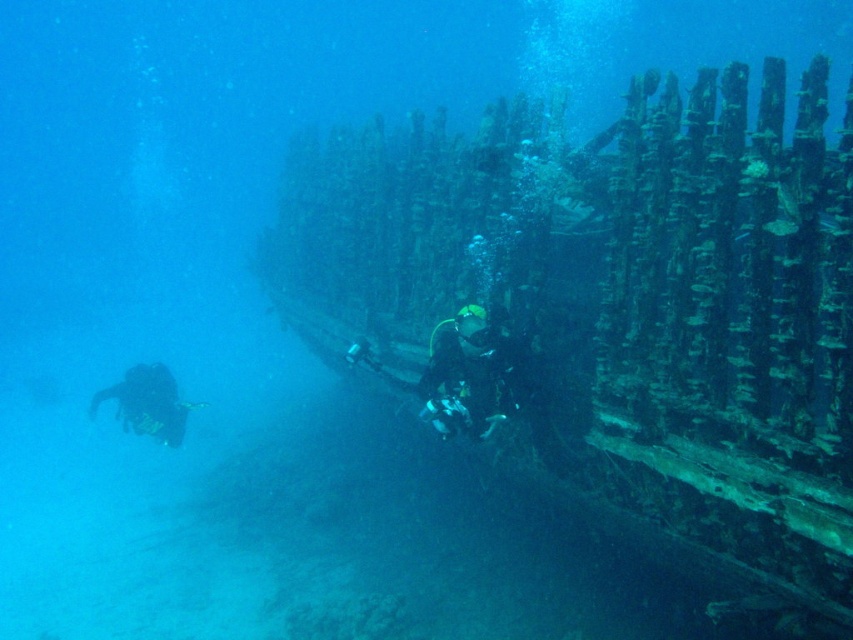
You are a scuba diver swimming towards the shipwreck in the image. You notice two points marked in the scene. Which point, point (445, 349) or point (154, 403), is closer to you as you approach the shipwreck?

Point (445, 349) is closer to the camera than point (154, 403), so it is closer to you as you approach the shipwreck.

You are a third observer looking at the underwater scene. You see the black matte diving suit at center and the black scuba diver at lower left. Which object is closer to you?

The black matte diving suit at center is closer to you because it is in front of the black scuba diver at lower left.

You are a marine biologist observing the underwater scene. You need to locate the black matte diving suit at center. What are its coordinates?

The black matte diving suit at center is located at coordinates point (465, 376).